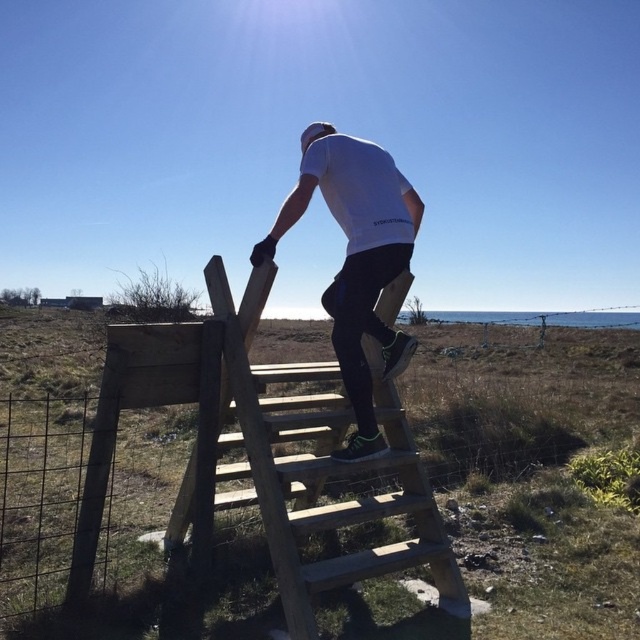
You are trying to reach the top of the wooden stairs at center but notice the white matte shirt at upper center is in the way. Can you still climb the stairs without moving the shirt?

The wooden stairs at center has a lesser height compared to white matte shirt at upper center, so the shirt is taller than the stairs. This means the shirt might block your path, making it difficult to climb the stairs without moving it.

You are standing in the outdoor scene and want to place a small flag at the point closer to you between point (301, 502) and point (259, 252). Which point should you choose?

You should choose point (301, 502) because it is closer to you than point (259, 252).